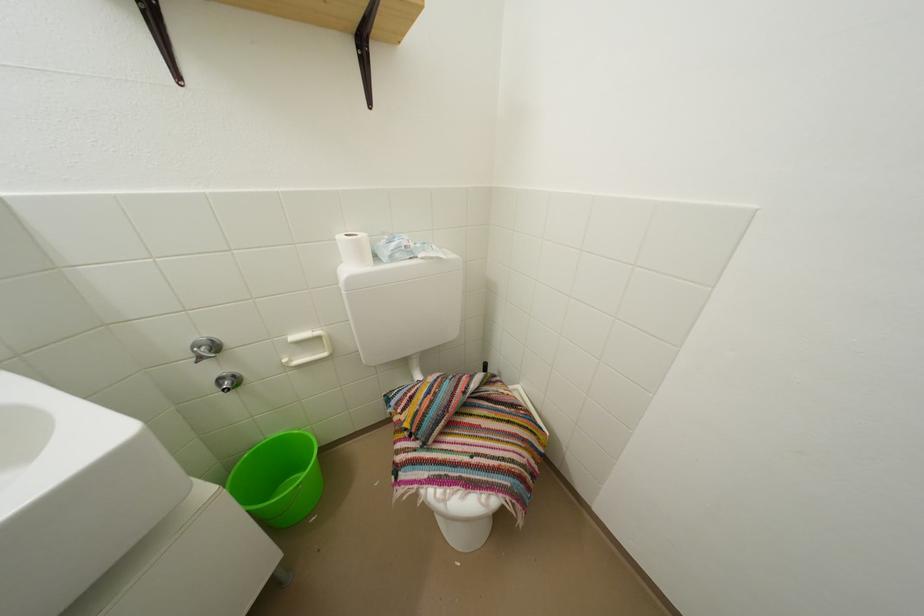
The width and height of the screenshot is (924, 616). What do you see at coordinates (205, 347) in the screenshot? I see `the chrome faucet handle` at bounding box center [205, 347].